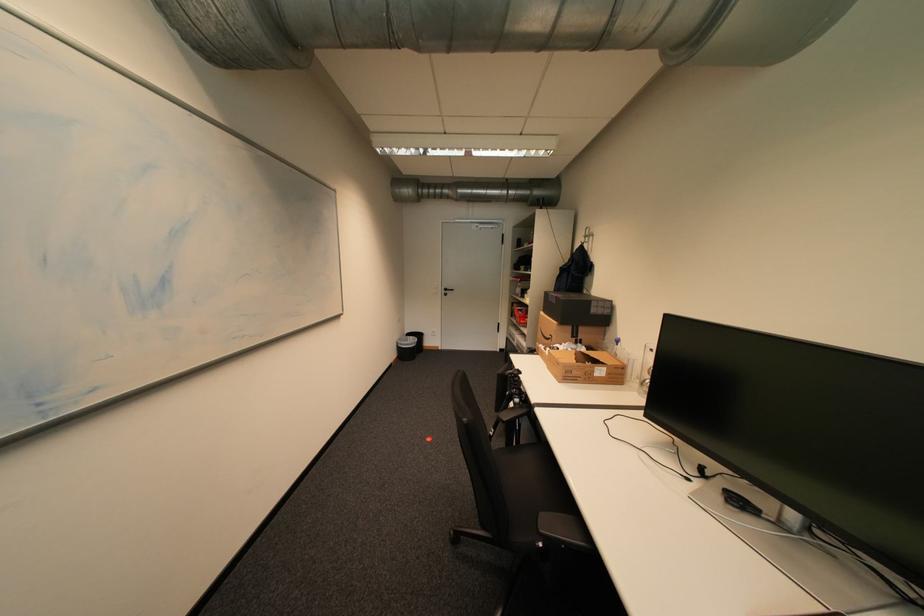
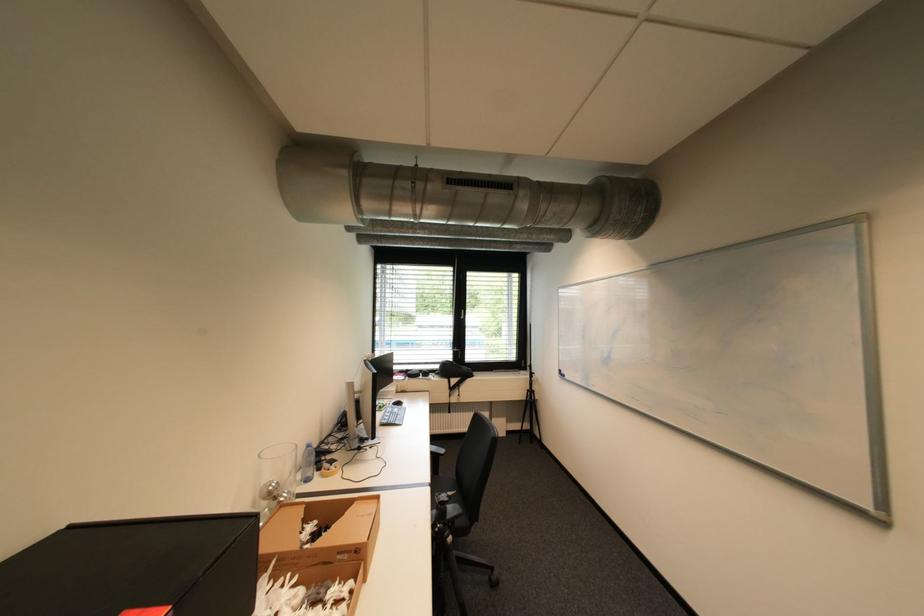
Find the pixel in the second image that matches the point at 608,361 in the first image.

(311, 520)